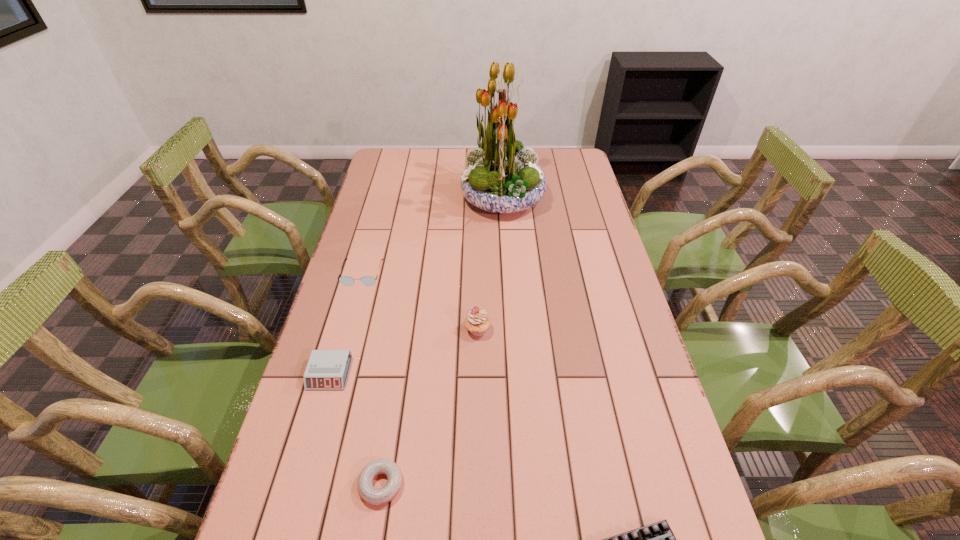
Identify the location of blank space located on the front-facing side of the tallest object. The width and height of the screenshot is (960, 540). (443, 199).

This screenshot has height=540, width=960. Identify the location of free spot located on the left of the second tallest object. (416, 329).

Where is `vacant region located 0.380m on the lenses of the spectacles`? Image resolution: width=960 pixels, height=540 pixels. vacant region located 0.380m on the lenses of the spectacles is located at coordinates [328, 394].

Locate an element on the screen. The image size is (960, 540). vacant space located 0.070m on the right of the third nearest object is located at coordinates (375, 373).

Locate an element on the screen. free space located 0.240m on the back of the fourth object from right to left is located at coordinates (398, 371).

You are a GUI agent. You are given a task and a screenshot of the screen. Output one action in this format:
    pyautogui.click(x=<x>, y=<y>)
    Task: Click on the object that is positioned at the far edge
    The image size is (960, 540).
    Given the screenshot: What is the action you would take?
    pyautogui.click(x=501, y=176)

The height and width of the screenshot is (540, 960). Identify the location of spectacles at the left edge. (347, 281).

Image resolution: width=960 pixels, height=540 pixels. I want to click on alarm clock present at the left edge, so click(327, 369).

Identify the location of free space at the left edge. (344, 397).

The width and height of the screenshot is (960, 540). In order to click on vacant space at the right edge of the desktop in this screenshot , I will do `click(590, 212)`.